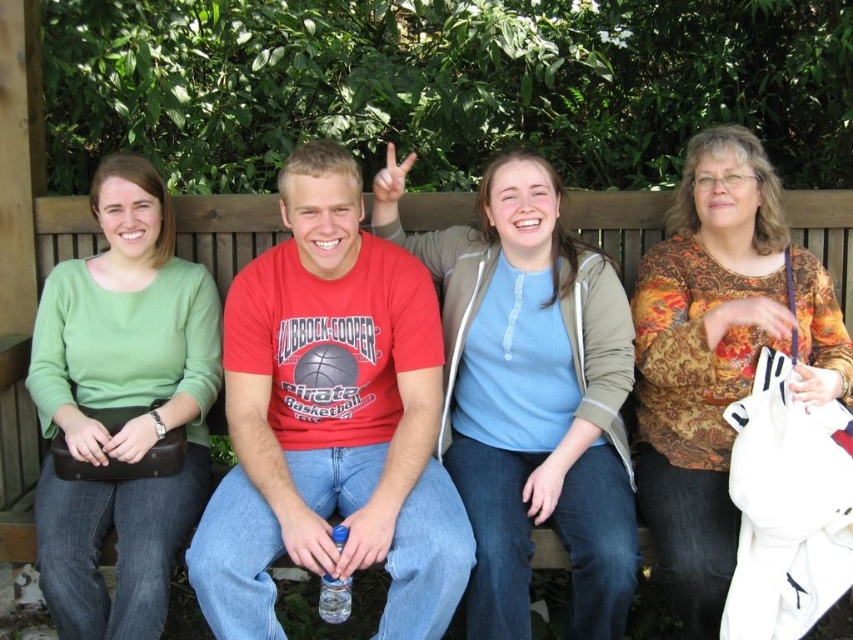
Question: Does red cotton t-shirt at center have a greater width compared to floral-patterned blouse at right?

Choices:
 (A) no
 (B) yes

Answer: (B)

Question: Does green matte sweater at left have a larger size compared to floral-patterned blouse at right?

Choices:
 (A) no
 (B) yes

Answer: (A)

Question: Does red cotton t-shirt at center appear on the right side of light blue sweater at center?

Choices:
 (A) yes
 (B) no

Answer: (B)

Question: Which is nearer to the red cotton t-shirt at center?

Choices:
 (A) light blue sweater at center
 (B) floral-patterned blouse at right
 (C) green matte sweater at left

Answer: (A)

Question: Which object is the closest to the green matte sweater at left?

Choices:
 (A) floral-patterned blouse at right
 (B) light blue sweater at center
 (C) red cotton t-shirt at center

Answer: (C)

Question: Among these points, which one is nearest to the camera?

Choices:
 (A) (392, 250)
 (B) (32, 346)
 (C) (708, 369)

Answer: (C)